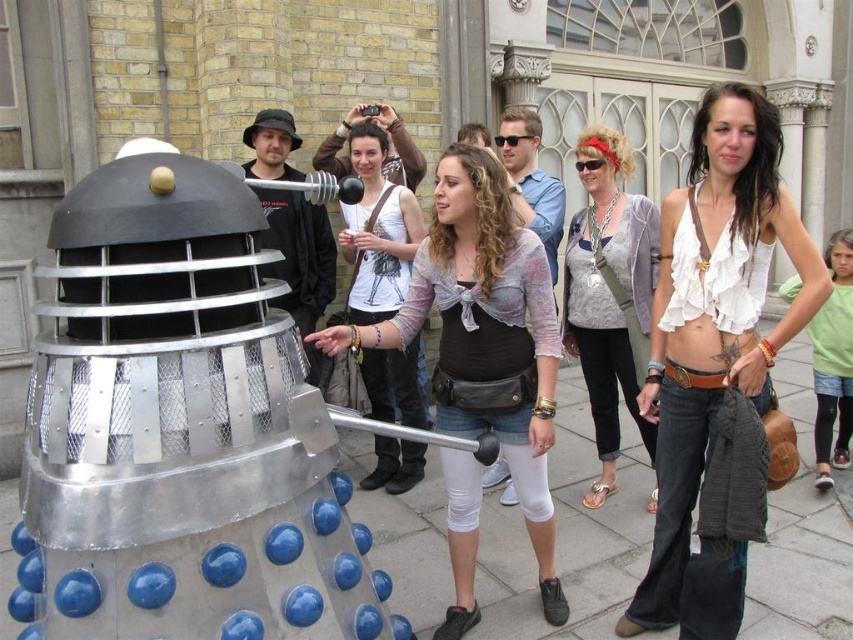
Question: Which point is farther to the camera?

Choices:
 (A) (460, 580)
 (B) (498, 342)
 (C) (405, 406)

Answer: (C)

Question: Estimate the real-world distances between objects in this image. Which object is farther from the matte black top at center?

Choices:
 (A) brushed metal dalek at center
 (B) white ruffled tank top at center
 (C) matte black shirt at center

Answer: (A)

Question: Which object is farther from the camera taking this photo?

Choices:
 (A) matte black top at center
 (B) matte black shirt at center
 (C) green fabric shirt at right

Answer: (C)

Question: Can you confirm if white cotton tank top at center is bigger than green fabric shirt at right?

Choices:
 (A) yes
 (B) no

Answer: (B)

Question: Is matte gray tank top at center positioned before white cotton tank top at center?

Choices:
 (A) yes
 (B) no

Answer: (A)

Question: Does white ruffled tank top at center have a larger size compared to green fabric shirt at right?

Choices:
 (A) yes
 (B) no

Answer: (A)